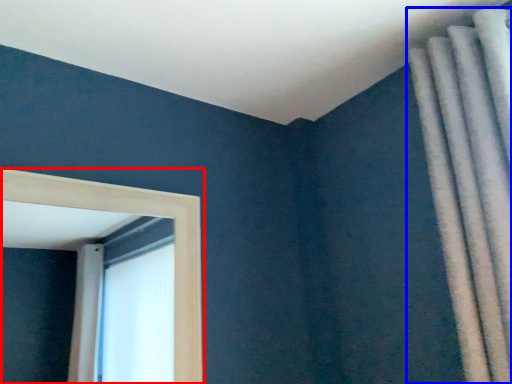
Question: Which object is closer to the camera taking this photo, window (highlighted by a red box) or curtain (highlighted by a blue box)?

Choices:
 (A) window
 (B) curtain

Answer: (B)